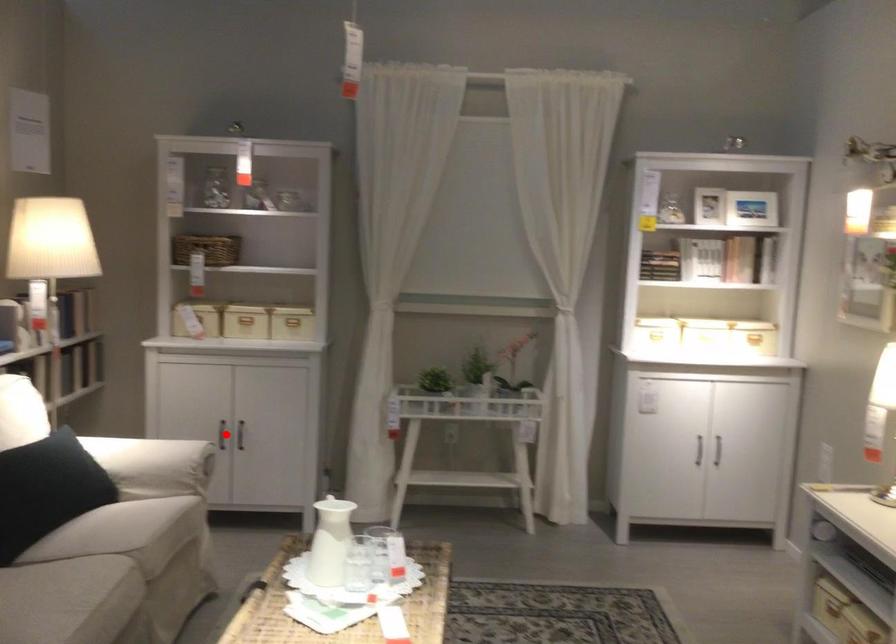
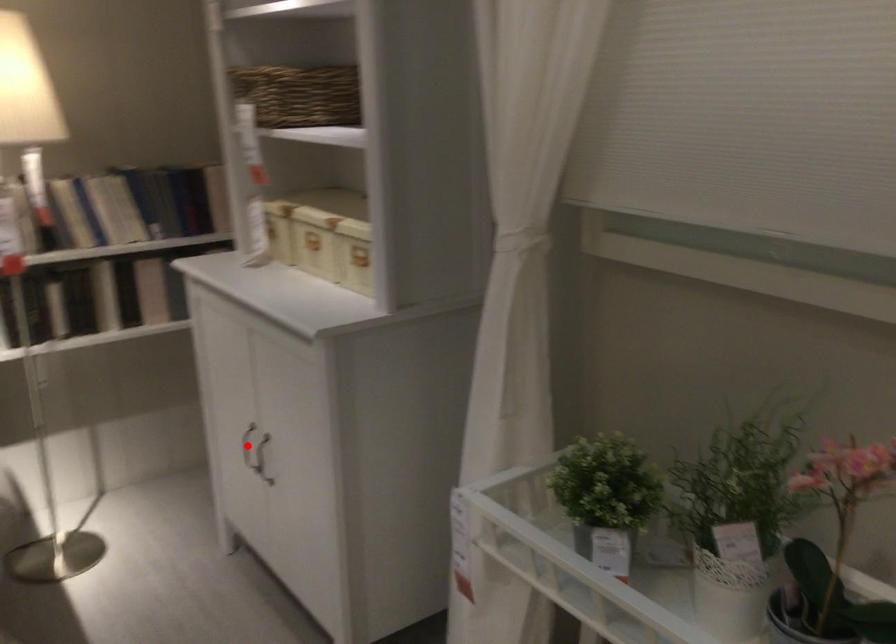
I am providing you with two images of the same scene from different viewpoints. A red point is marked on the first image and another point is marked on the second image. Do the highlighted points in image1 and image2 indicate the same real-world spot?

Yes